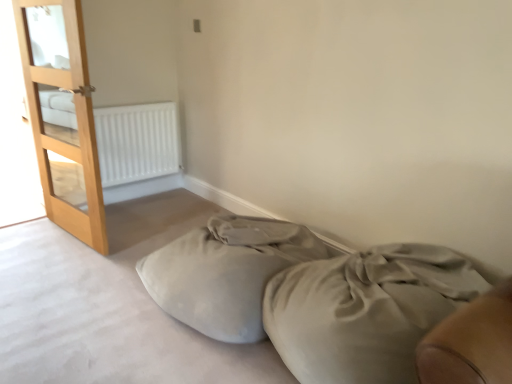
Question: Is white matte radiator at upper left looking in the opposite direction of satin beige bed at lower right?

Choices:
 (A) no
 (B) yes

Answer: (A)

Question: Is white matte radiator at upper left not within satin beige bed at lower right?

Choices:
 (A) no
 (B) yes

Answer: (B)

Question: Does white matte radiator at upper left lie behind satin beige bed at lower right?

Choices:
 (A) no
 (B) yes

Answer: (B)

Question: From the image's perspective, is white matte radiator at upper left under satin beige bed at lower right?

Choices:
 (A) yes
 (B) no

Answer: (B)

Question: Is white matte radiator at upper left closer to camera compared to satin beige bed at lower right?

Choices:
 (A) yes
 (B) no

Answer: (B)

Question: From the image's perspective, does white matte radiator at upper left appear higher than satin beige bed at lower right?

Choices:
 (A) yes
 (B) no

Answer: (A)

Question: Considering the relative sizes of soft beige fabric bean bag at lower center and white matte radiator at upper left in the image provided, is soft beige fabric bean bag at lower center taller than white matte radiator at upper left?

Choices:
 (A) yes
 (B) no

Answer: (B)

Question: Are soft beige fabric bean bag at lower center and white matte radiator at upper left located far from each other?

Choices:
 (A) yes
 (B) no

Answer: (A)

Question: Can you confirm if soft beige fabric bean bag at lower center is bigger than white matte radiator at upper left?

Choices:
 (A) yes
 (B) no

Answer: (A)

Question: Is soft beige fabric bean bag at lower center thinner than white matte radiator at upper left?

Choices:
 (A) yes
 (B) no

Answer: (B)

Question: From a real-world perspective, is soft beige fabric bean bag at lower center under white matte radiator at upper left?

Choices:
 (A) yes
 (B) no

Answer: (A)

Question: From the image's perspective, is soft beige fabric bean bag at lower center below white matte radiator at upper left?

Choices:
 (A) yes
 (B) no

Answer: (A)

Question: Does white matte radiator at upper left appear on the left side of light brown wooden door at left?

Choices:
 (A) yes
 (B) no

Answer: (B)